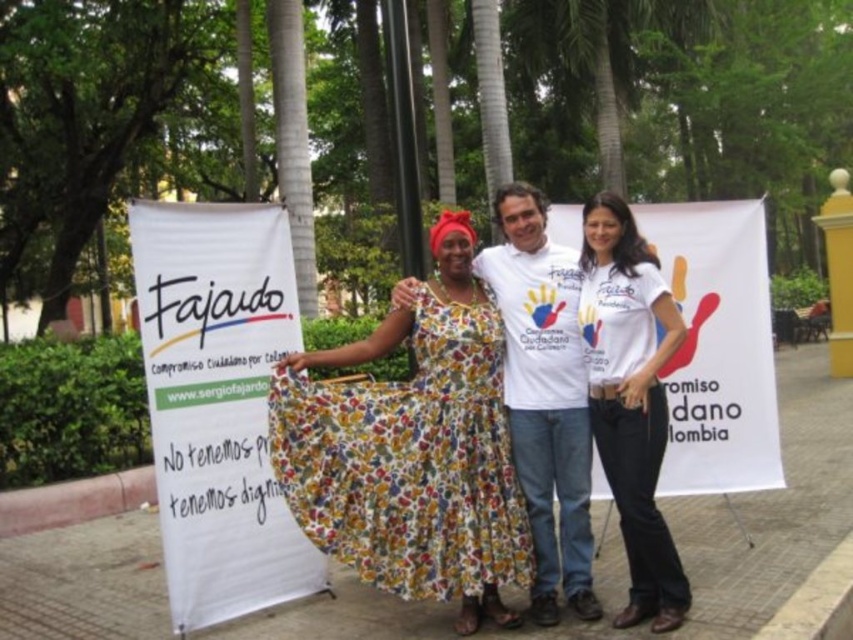
Question: Which point is farther to the camera?

Choices:
 (A) white fabric banner at left
 (B) floral cotton dress at center
 (C) white cotton t-shirt at center
 (D) white fabric banner at center

Answer: (D)

Question: Estimate the real-world distances between objects in this image. Which object is closer to the white fabric banner at center?

Choices:
 (A) white t-shirt at center
 (B) white fabric banner at left
 (C) white cotton t-shirt at center

Answer: (C)

Question: Which point is closer to the camera?

Choices:
 (A) white fabric banner at left
 (B) white cotton t-shirt at center

Answer: (B)

Question: Is white fabric banner at left bigger than white t-shirt at center?

Choices:
 (A) no
 (B) yes

Answer: (B)

Question: Does white fabric banner at left have a lesser width compared to white fabric banner at center?

Choices:
 (A) no
 (B) yes

Answer: (B)

Question: Does white fabric banner at center come in front of white t-shirt at center?

Choices:
 (A) no
 (B) yes

Answer: (A)